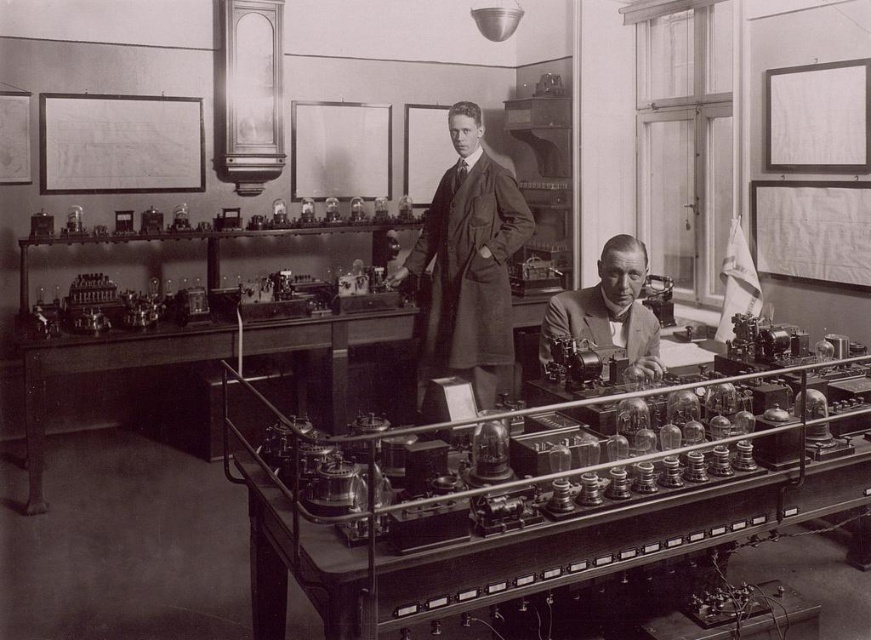
You are a visitor in this laboratory and want to touch the metallic glass tubes at center and the light brown suit at center. Which object can you reach first without moving your position?

The metallic glass tubes at center can be reached first because they are closer to the viewer than the light brown suit at center.

You are a researcher in the vintage laboratory depicted. You need to place a new metallic glass tube exactly at point (525, 508). According to the scene, what object is already located at that point?

The metallic glass tubes at center are located at point (525, 508).

You are a scientist in the light brown suit at center who wants to move to the window on the right side of the room. The metallic glass tubes at center are in your path. Can you walk around them without bending or moving the tubes?

The metallic glass tubes at center might be wider than the light brown suit at center, so it might be difficult to walk around them without bending or moving the tubes.